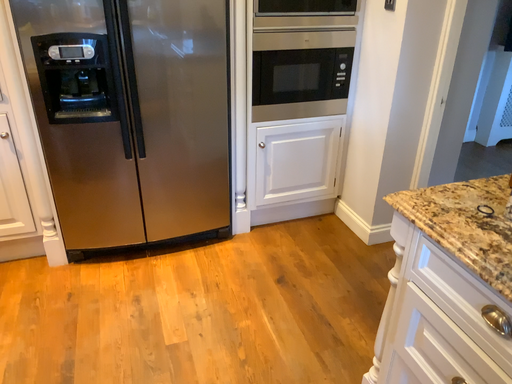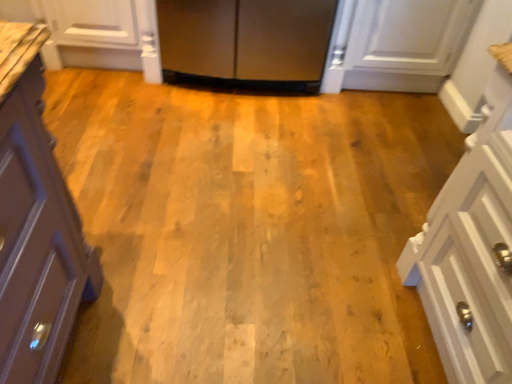
Question: Which way did the camera rotate in the video?

Choices:
 (A) rotated upward
 (B) rotated downward

Answer: (B)